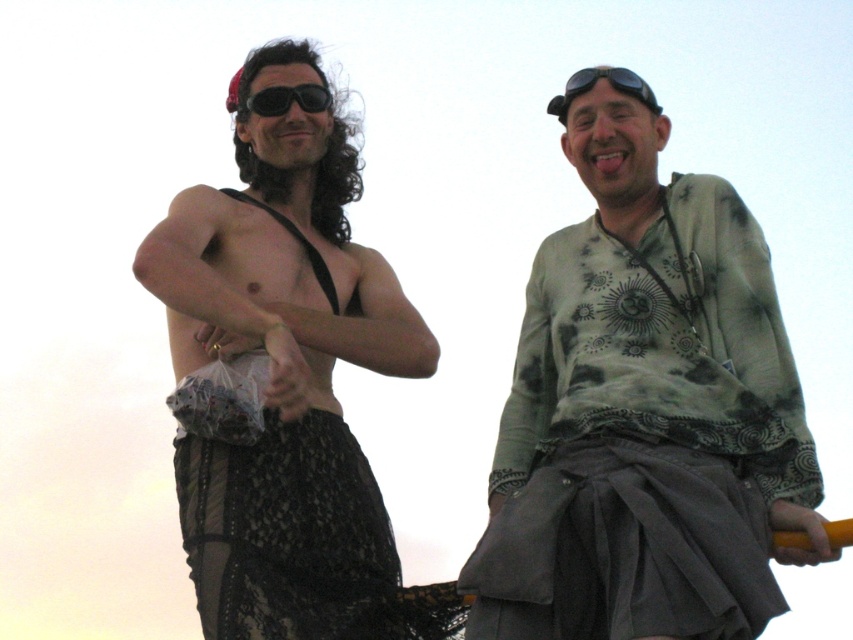
Does black lace skirt at left have a smaller size compared to black matte goggles at upper center?

Incorrect, black lace skirt at left is not smaller in size than black matte goggles at upper center.

Does black lace skirt at left have a larger size compared to black matte goggles at upper center?

Correct, black lace skirt at left is larger in size than black matte goggles at upper center.

Which is in front, point (372, 561) or point (572, 81)?

Positioned in front is point (372, 561).

At what (x,y) coordinates should I click in order to perform the action: click on black lace skirt at left. Please return your answer as a coordinate pair (x, y). Looking at the image, I should click on (285, 381).

Who is positioned more to the right, black matte goggles at upper center or black matte sunglasses at upper center?

Positioned to the right is black matte goggles at upper center.

Describe the element at coordinates (610, 84) in the screenshot. This screenshot has height=640, width=853. I see `black matte goggles at upper center` at that location.

The image size is (853, 640). Identify the location of black matte goggles at upper center. (610, 84).

Between point (630, 529) and point (323, 96), which one is positioned behind?

The point (323, 96) is behind.

Is green tie-dye shirt at upper right positioned behind black matte sunglasses at upper center?

No, it is not.

Locate an element on the screen. The width and height of the screenshot is (853, 640). green tie-dye shirt at upper right is located at coordinates (645, 413).